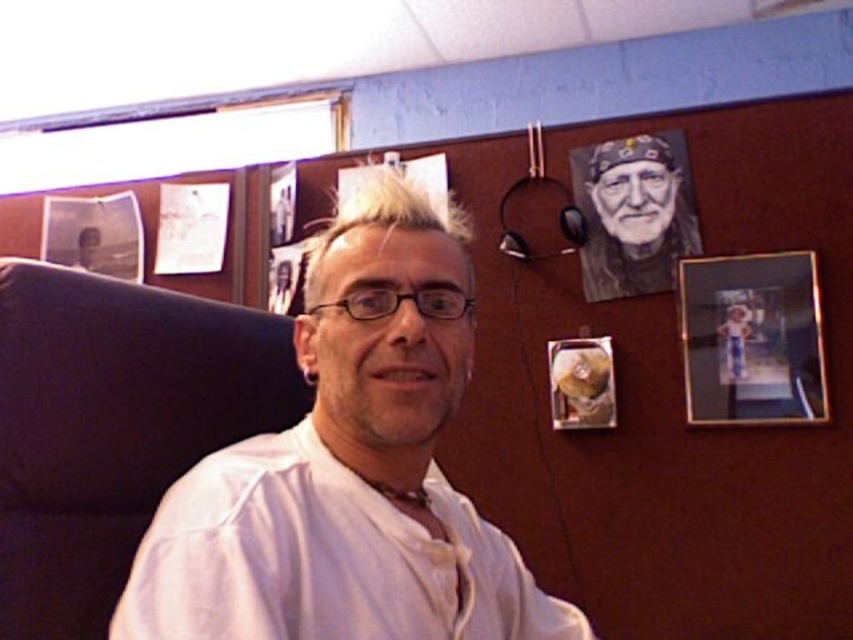
Question: Is white matte shirt at center smaller than black fabric swivel chair at left?

Choices:
 (A) no
 (B) yes

Answer: (A)

Question: Among these objects, which one is farthest from the camera?

Choices:
 (A) white matte shirt at center
 (B) black fabric swivel chair at left

Answer: (B)

Question: Which point appears closest to the camera in this image?

Choices:
 (A) (640, 228)
 (B) (720, 328)

Answer: (B)

Question: Estimate the real-world distances between objects in this image. Which object is farther from the white matte shirt at center?

Choices:
 (A) gold metallic photo frame at upper right
 (B) charcoal sketch portrait at upper right
 (C) metallic gold picture frame at center-right

Answer: (B)

Question: From the image, what is the correct spatial relationship of white matte shirt at center in relation to black fabric swivel chair at left?

Choices:
 (A) below
 (B) above

Answer: (A)

Question: Is charcoal sketch portrait at upper right further to camera compared to metallic gold picture frame at center-right?

Choices:
 (A) no
 (B) yes

Answer: (B)